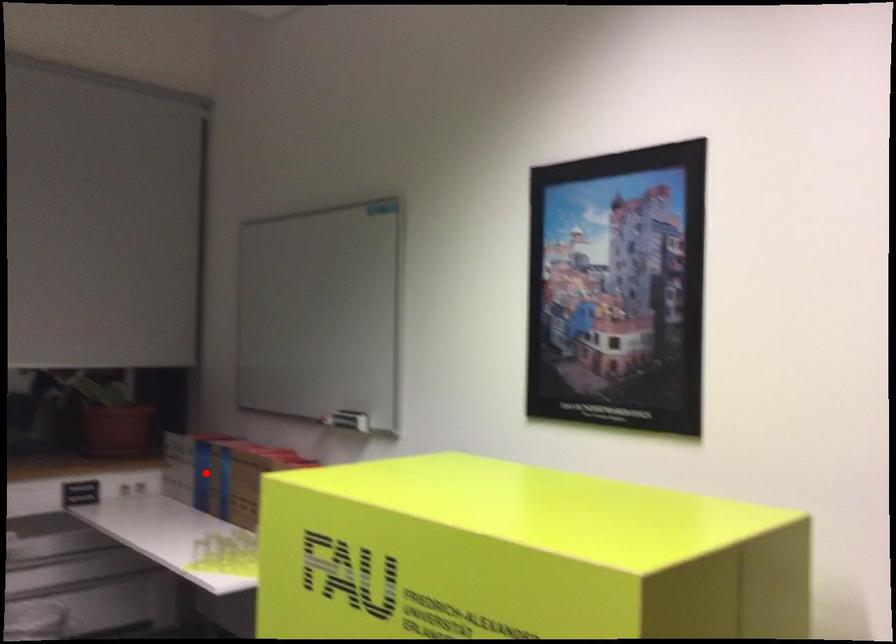
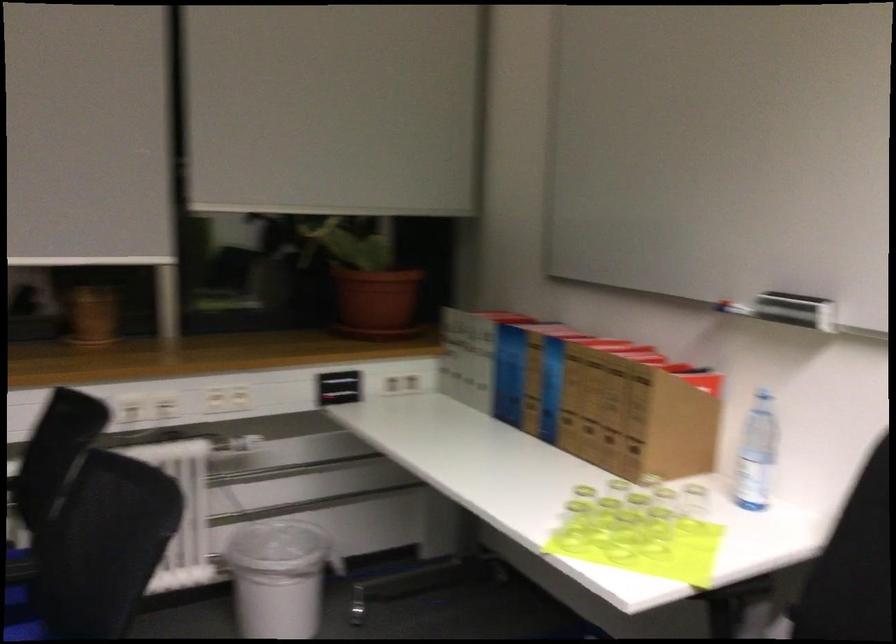
Find the pixel in the second image that matches the highlighted location in the first image.

(509, 374)